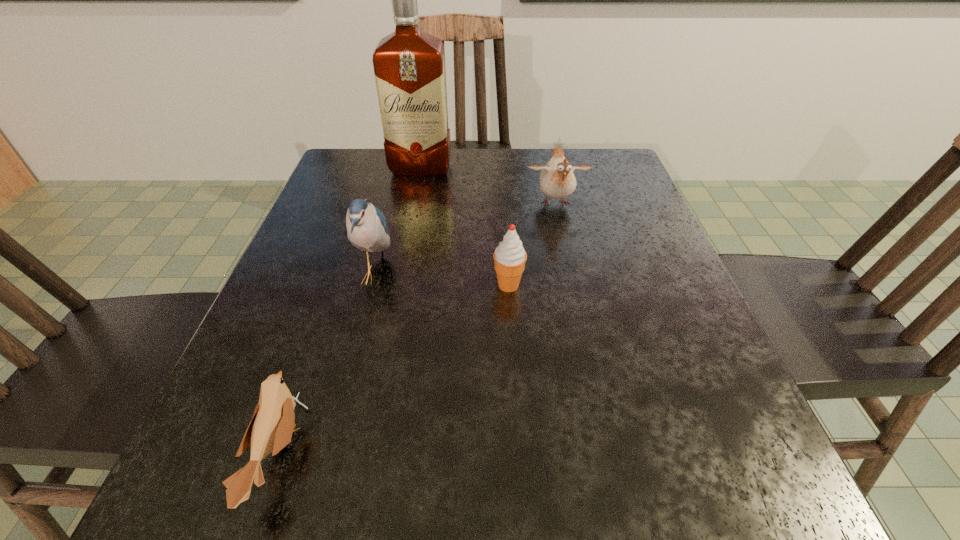
At what (x,y) coordinates should I click in order to perform the action: click on liquor. Please return your answer as a coordinate pair (x, y). The width and height of the screenshot is (960, 540). Looking at the image, I should click on (409, 65).

The height and width of the screenshot is (540, 960). Identify the location of the farthest object. (409, 65).

This screenshot has width=960, height=540. What are the coordinates of `the fourth shortest object` in the screenshot? It's located at (367, 230).

This screenshot has width=960, height=540. I want to click on the second bird from right to left, so [x=367, y=230].

I want to click on the second shortest bird, so click(x=557, y=180).

This screenshot has width=960, height=540. Find the location of `the farthest bird`. the farthest bird is located at coordinates (557, 180).

Locate an element on the screen. the second object from right to left is located at coordinates (509, 256).

The image size is (960, 540). Find the location of `the shortest bird`. the shortest bird is located at coordinates (270, 430).

At what (x,y) coordinates should I click in order to perform the action: click on the leftmost bird. Please return your answer as a coordinate pair (x, y). The width and height of the screenshot is (960, 540). Looking at the image, I should click on (270, 430).

What are the coordinates of `vacant space located 0.190m on the front label of the tallest object` in the screenshot? It's located at (410, 224).